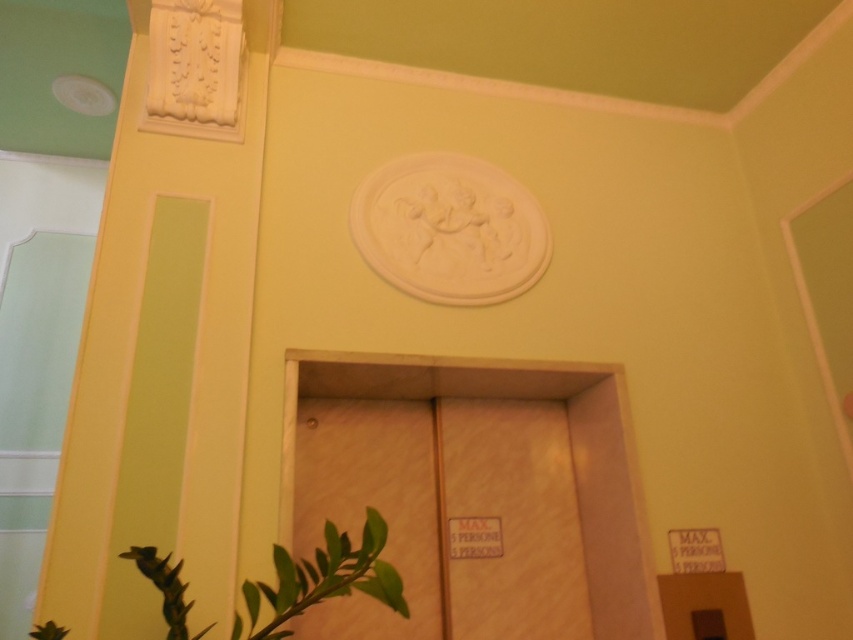
Question: Does wooden elevator at center have a smaller size compared to green matte plant at lower left?

Choices:
 (A) yes
 (B) no

Answer: (B)

Question: Is wooden elevator at center to the right of green matte plant at lower left from the viewer's perspective?

Choices:
 (A) yes
 (B) no

Answer: (A)

Question: Which of the following is the farthest from the observer?

Choices:
 (A) [x=258, y=602]
 (B) [x=337, y=388]

Answer: (B)

Question: Observing the image, what is the correct spatial positioning of wooden elevator at center in reference to green matte plant at lower left?

Choices:
 (A) above
 (B) below

Answer: (A)